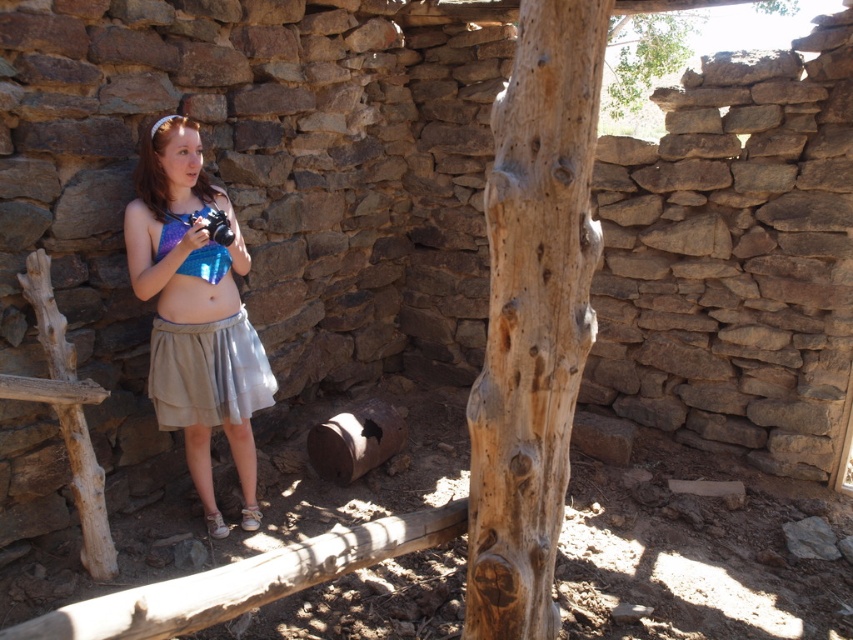
Question: Which object appears closest to the camera in this image?

Choices:
 (A) light brown rough wood at center
 (B) shiny blue fabric at center
 (C) gray fabric skirt at lower left

Answer: (A)

Question: Is shiny blue fabric at center wider than shiny metallic bikini top at center?

Choices:
 (A) no
 (B) yes

Answer: (B)

Question: Is gray fabric skirt at lower left below rough wood tree at upper center?

Choices:
 (A) no
 (B) yes

Answer: (B)

Question: Which object is farther from the camera taking this photo?

Choices:
 (A) gray fabric skirt at lower left
 (B) rough wood tree at upper center

Answer: (B)

Question: Considering the real-world distances, which object is farthest from the shiny metallic bikini top at center?

Choices:
 (A) gray fabric skirt at lower left
 (B) shiny blue fabric at center

Answer: (A)

Question: Is shiny blue fabric at center smaller than rough wood tree at upper center?

Choices:
 (A) yes
 (B) no

Answer: (A)